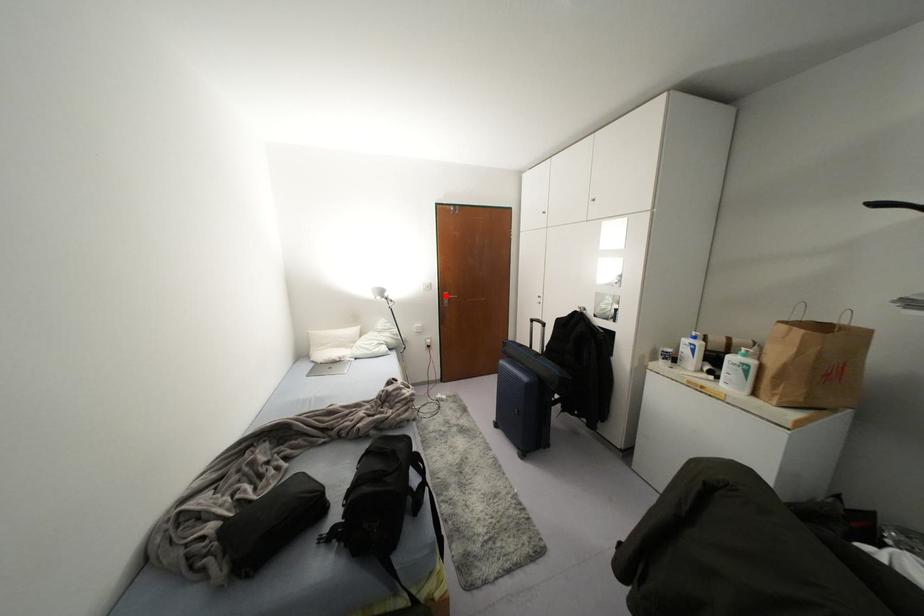
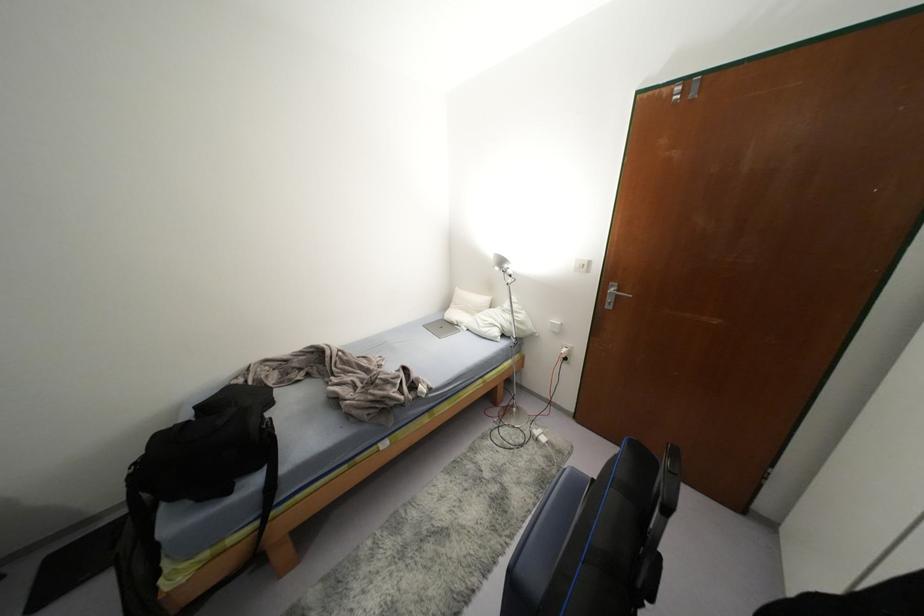
The point at the highlighted location is marked in the first image. Where is the corresponding point in the second image?

(612, 289)